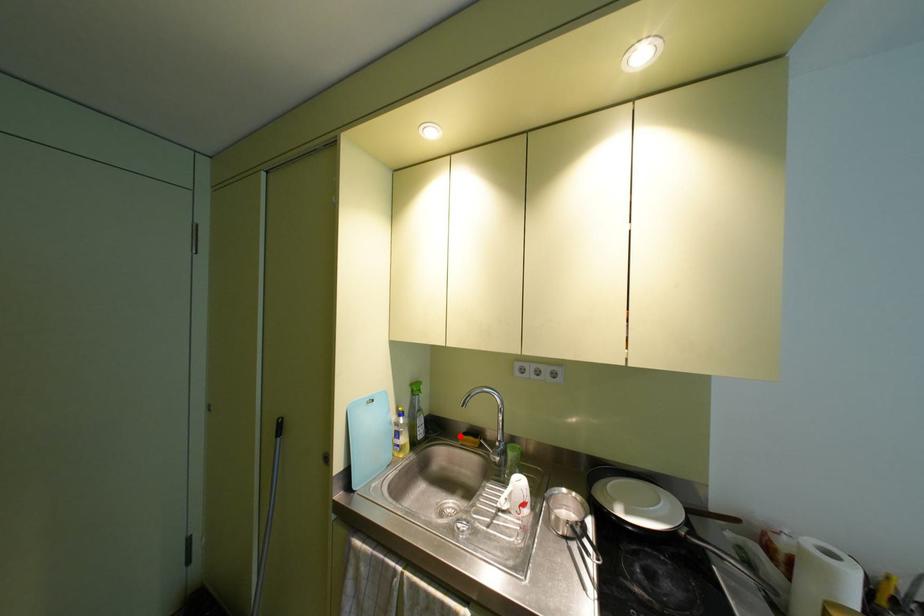
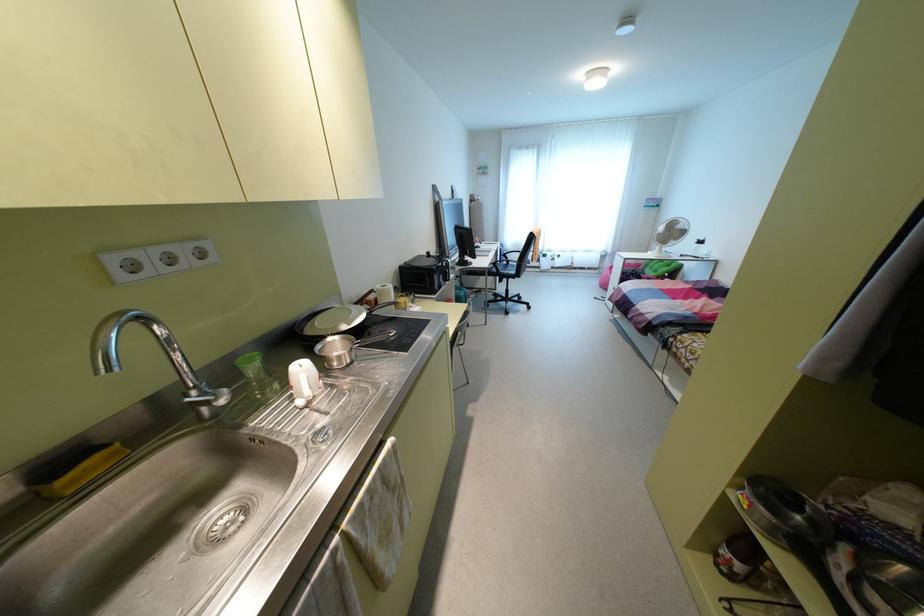
In the second image, find the point that corresponds to the highlighted location in the first image.

(59, 482)